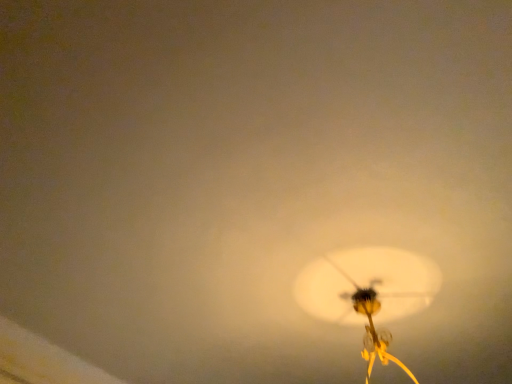
Where is `translucent plastic lamp at center`? translucent plastic lamp at center is located at coordinates (368, 292).

The width and height of the screenshot is (512, 384). What do you see at coordinates (368, 292) in the screenshot?
I see `translucent plastic lamp at center` at bounding box center [368, 292].

Image resolution: width=512 pixels, height=384 pixels. I want to click on translucent plastic lamp at center, so click(x=368, y=292).